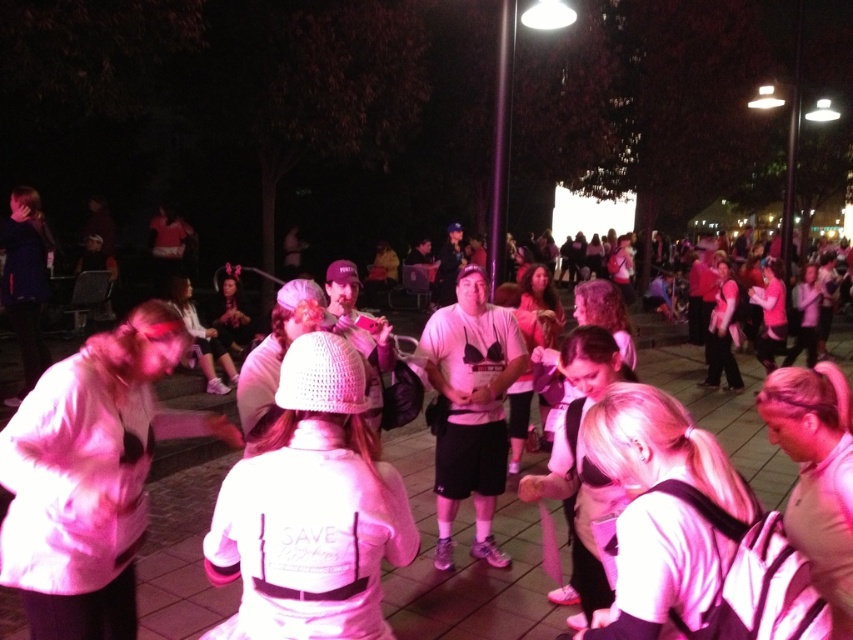
Looking at this image, you are organizing a photo shoot and want to ensure that both the white matte jacket at center and the white knitted hat at center are visible in the frame. Given their sizes, which object should you focus on to ensure both are in the frame without cropping?

The white matte jacket at center is taller than the white knitted hat at center, so focusing on the white matte jacket at center will ensure both objects are visible in the frame without cropping.